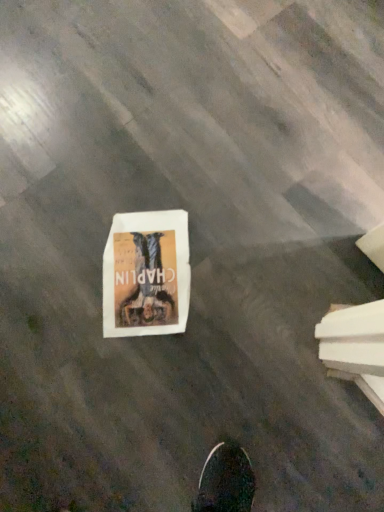
Where is `vacant space underneath white paper comic book at center (from a real-world perspective)`? vacant space underneath white paper comic book at center (from a real-world perspective) is located at coordinates (144, 257).